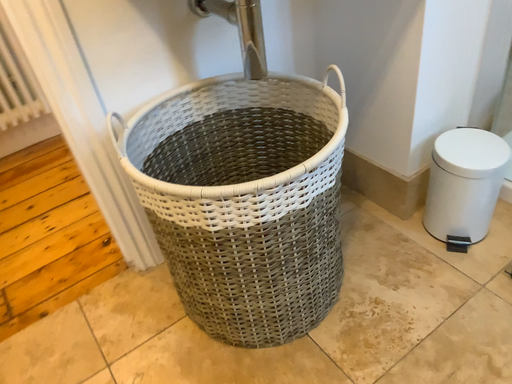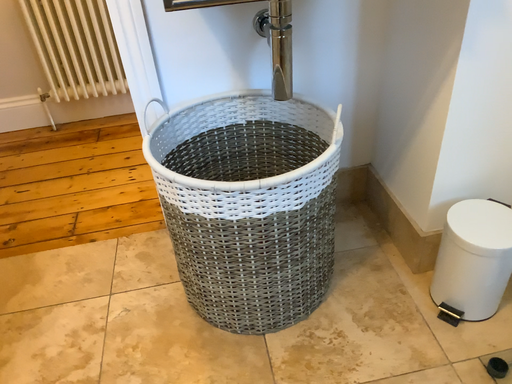
Question: Which way did the camera rotate in the video?

Choices:
 (A) rotated right
 (B) rotated left

Answer: (B)